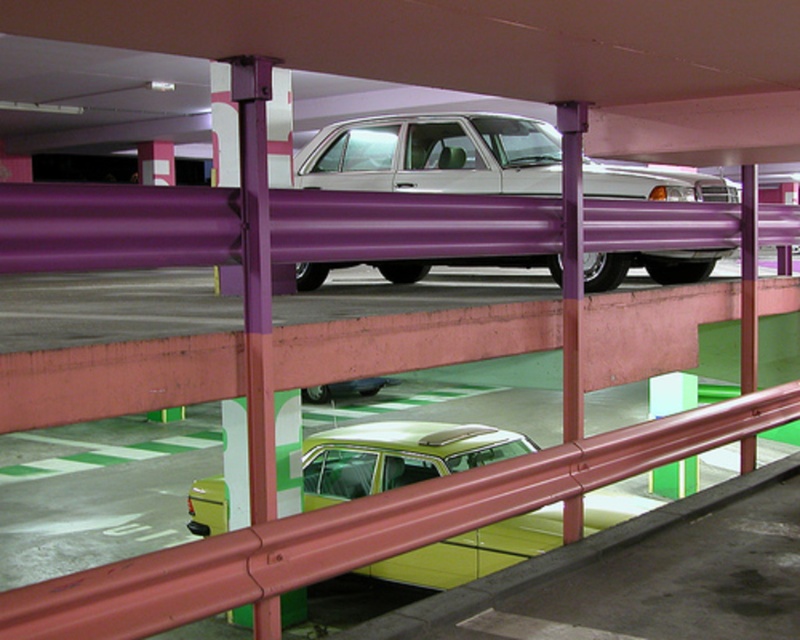
Question: Is silver metallic sedan at center smaller than metallic silver sedan at lower center?

Choices:
 (A) yes
 (B) no

Answer: (A)

Question: Which of the following is the closest to the observer?

Choices:
 (A) (450, 440)
 (B) (372, 387)
 (C) (512, 150)

Answer: (C)

Question: Which of the following is the closest to the observer?

Choices:
 (A) (329, 128)
 (B) (494, 544)
 (C) (344, 396)

Answer: (B)

Question: Which point appears closest to the camera in this image?

Choices:
 (A) (509, 541)
 (B) (316, 396)
 (C) (530, 122)

Answer: (A)

Question: Is silver metallic sedan at center positioned in front of metallic silver sedan at lower center?

Choices:
 (A) no
 (B) yes

Answer: (A)

Question: Does silver metallic sedan at center come in front of metallic silver sedan at lower center?

Choices:
 (A) no
 (B) yes

Answer: (A)